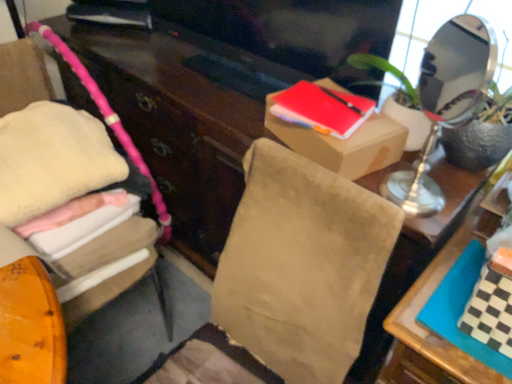
Measure the distance between point (406,138) and camera.

Point (406,138) is 3.59 feet away from camera.

In order to face matte red notebook at upper center, the second book in the bottom-to-top sequence, should I rotate leftwards or rightwards?

To align with it, rotate right about 8.959°.

The image size is (512, 384). What do you see at coordinates (478, 143) in the screenshot? I see `green textured plant at upper right` at bounding box center [478, 143].

At what (x,y) coordinates should I click in order to perform the action: click on matte cardboard box at upper right. Please return your answer as a coordinate pair (x, y). Looking at the image, I should click on (344, 144).

Locate an element on the screen. Image resolution: width=512 pixels, height=384 pixels. houseplant in front of the matte cardboard box at upper right is located at coordinates (478, 143).

Is matte cardboard box at upper right located within green textured plant at upper right?

That's incorrect, matte cardboard box at upper right is not inside green textured plant at upper right.

From the picture: Does green textured plant at upper right have a larger size compared to matte cardboard box at upper right?

Correct, green textured plant at upper right is larger in size than matte cardboard box at upper right.

Which is nearer, (x=490, y=127) or (x=322, y=146)?

Point (x=490, y=127) is closer to the camera than point (x=322, y=146).

Considering the relative positions of soft pink fabric at left and checkerboard-patterned book at right, arranged as the 1th book when ordered from the bottom, in the image provided, is soft pink fabric at left to the left or to the right of checkerboard-patterned book at right, arranged as the 1th book when ordered from the bottom,?

Based on their positions, soft pink fabric at left is located to the left of checkerboard-patterned book at right, arranged as the 1th book when ordered from the bottom.

Could you tell me if soft pink fabric at left is turned towards checkerboard-patterned book at right, which is the 2th book in back-to-front order?

No, soft pink fabric at left is not facing towards checkerboard-patterned book at right, which is the 2th book in back-to-front order.

Which is correct: soft pink fabric at left is inside checkerboard-patterned book at right, which is the 2th book in back-to-front order, or outside of it?

soft pink fabric at left is not inside checkerboard-patterned book at right, which is the 2th book in back-to-front order, it's outside.

How many degrees apart are the facing directions of soft pink fabric at left and checkerboard-patterned book at right, the first book when ordered from right to left?

77.2 degrees.

Is matte red notebook at upper center, placed as the second book when sorted from front to back, further to the viewer compared to matte cardboard box at upper right?

Yes, it is behind matte cardboard box at upper right.

Between matte red notebook at upper center, acting as the first book starting from the back, and matte cardboard box at upper right, which one has larger width?

matte cardboard box at upper right.

Is matte red notebook at upper center, the second book in the bottom-to-top sequence, positioned with its back to matte cardboard box at upper right?

No, matte red notebook at upper center, the second book in the bottom-to-top sequence,'s orientation is not away from matte cardboard box at upper right.

Does matte red notebook at upper center, which is counted as the first book, starting from the top, appear on the right side of matte cardboard box at upper right?

No.

Who is smaller, green textured plant at upper right or soft pink fabric at left?

green textured plant at upper right is smaller.

Measure the distance between green textured plant at upper right and soft pink fabric at left.

green textured plant at upper right is 1.05 meters away from soft pink fabric at left.

Does green textured plant at upper right turn towards soft pink fabric at left?

No, green textured plant at upper right does not turn towards soft pink fabric at left.

Relative to matte red notebook at upper center, acting as the first book starting from the back, is soft pink fabric at left in front or behind?

Clearly, soft pink fabric at left is in front of matte red notebook at upper center, acting as the first book starting from the back.

Considering the relative sizes of soft pink fabric at left and matte red notebook at upper center, which is counted as the first book, starting from the top, in the image provided, is soft pink fabric at left taller than matte red notebook at upper center, which is counted as the first book, starting from the top,?

Correct, soft pink fabric at left is much taller as matte red notebook at upper center, which is counted as the first book, starting from the top.

Which point is more distant from viewer, (25, 65) or (295, 100)?

The point (25, 65) is more distant.

Identify the location of furniture lying below the matte red notebook at upper center, the second book from the right (from the image's perspective). (23, 76).

Is soft pink fabric at left at the back of checkerboard-patterned book at right, which is the first book from front to back?

checkerboard-patterned book at right, which is the first book from front to back, is not turned away from soft pink fabric at left.

Is checkerboard-patterned book at right, which is the 2th book in back-to-front order, smaller than soft pink fabric at left?

Indeed, checkerboard-patterned book at right, which is the 2th book in back-to-front order, has a smaller size compared to soft pink fabric at left.

From the image's perspective, which is below, checkerboard-patterned book at right, the first book when ordered from right to left, or soft pink fabric at left?

checkerboard-patterned book at right, the first book when ordered from right to left.

Which is more to the left, checkerboard-patterned book at right, which is the first book from front to back, or soft pink fabric at left?

soft pink fabric at left is more to the left.

Identify the location of book in front of the matte cardboard box at upper right. Image resolution: width=512 pixels, height=384 pixels. (490, 305).

Considering the sizes of objects checkerboard-patterned book at right, which is the first book from front to back, and matte cardboard box at upper right in the image provided, who is smaller, checkerboard-patterned book at right, which is the first book from front to back, or matte cardboard box at upper right?

checkerboard-patterned book at right, which is the first book from front to back, is smaller.

Do you think checkerboard-patterned book at right, the 2th book viewed from the top, is within matte cardboard box at upper right, or outside of it?

checkerboard-patterned book at right, the 2th book viewed from the top, exists outside the volume of matte cardboard box at upper right.

How many degrees apart are the facing directions of checkerboard-patterned book at right, the second book from the left, and matte cardboard box at upper right?

The facing directions of checkerboard-patterned book at right, the second book from the left, and matte cardboard box at upper right are 19.6 degrees apart.

Locate an element on the screen. box that appears above the green textured plant at upper right (from the image's perspective) is located at coordinates (344, 144).

The height and width of the screenshot is (384, 512). Find the location of `furniture on the left of the checkerboard-patterned book at right, which is the 2th book in back-to-front order`. furniture on the left of the checkerboard-patterned book at right, which is the 2th book in back-to-front order is located at coordinates (23, 76).

Based on their spatial positions, is matte cardboard box at upper right or checkerboard-patterned book at right, the 2th book viewed from the top, further from soft pink fabric at left?

checkerboard-patterned book at right, the 2th book viewed from the top, lies further to soft pink fabric at left than the other object.

Considering their positions, is matte red notebook at upper center, the second book in the bottom-to-top sequence, positioned further to soft pink fabric at left than matte cardboard box at upper right?

The object further to soft pink fabric at left is matte cardboard box at upper right.

Estimate the real-world distances between objects in this image. Which object is closer to checkerboard-patterned book at right, which is the 2th book in back-to-front order, soft pink fabric at left or matte cardboard box at upper right?

matte cardboard box at upper right is positioned closer to the anchor checkerboard-patterned book at right, which is the 2th book in back-to-front order.

Estimate the real-world distances between objects in this image. Which object is further from matte cardboard box at upper right, checkerboard-patterned book at right, the first book when ordered from right to left, or matte red notebook at upper center, the second book from the right?

The object further to matte cardboard box at upper right is checkerboard-patterned book at right, the first book when ordered from right to left.

Based on their spatial positions, is matte red notebook at upper center, placed as the second book when sorted from front to back, or checkerboard-patterned book at right, the second book from the left, closer to green textured plant at upper right?

matte red notebook at upper center, placed as the second book when sorted from front to back, lies closer to green textured plant at upper right than the other object.

From the image, which object appears to be farther from matte cardboard box at upper right, checkerboard-patterned book at right, the second book from the left, or soft pink fabric at left?

The object further to matte cardboard box at upper right is soft pink fabric at left.

Estimate the real-world distances between objects in this image. Which object is closer to checkerboard-patterned book at right, the second book from the left, matte cardboard box at upper right or matte red notebook at upper center, placed as the second book when sorted from front to back?

Among the two, matte cardboard box at upper right is located nearer to checkerboard-patterned book at right, the second book from the left.

From the image, which object appears to be farther from checkerboard-patterned book at right, the 2th book viewed from the top, soft pink fabric at left or matte red notebook at upper center, placed as the second book when sorted from front to back?

Among the two, soft pink fabric at left is located further to checkerboard-patterned book at right, the 2th book viewed from the top.

You are a GUI agent. You are given a task and a screenshot of the screen. Output one action in this format:
    pyautogui.click(x=<x>, y=<y>)
    Task: Click on the box between matte red notebook at upper center, which is counted as the 1th book, starting from the left, and checkerboard-patterned book at right, the first book when ordered from right to left, in the up-down direction
    
    Given the screenshot: What is the action you would take?
    pyautogui.click(x=344, y=144)

Image resolution: width=512 pixels, height=384 pixels. I want to click on box between soft pink fabric at left and checkerboard-patterned book at right, the second book from the left, so click(344, 144).

This screenshot has width=512, height=384. In order to click on box located between green textured plant at upper right and matte red notebook at upper center, which is counted as the first book, starting from the top, in the depth direction in this screenshot , I will do `click(344, 144)`.

The width and height of the screenshot is (512, 384). I want to click on book located between soft pink fabric at left and matte cardboard box at upper right in the left-right direction, so click(x=322, y=109).